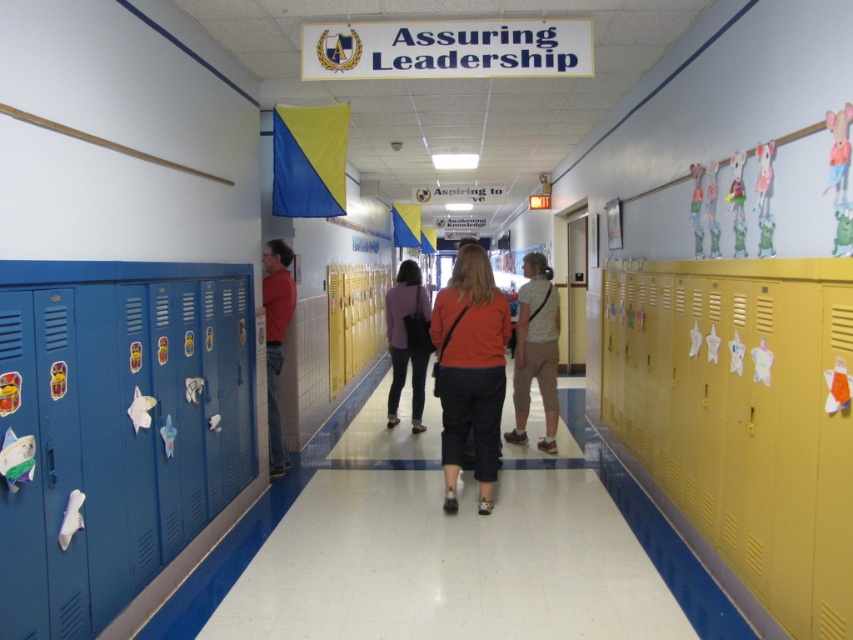
You are a student carrying a 3.5 feet wide poster. You need to walk through the hallway between the matte purple sweater at center and the matte red shirt at left. Will the poster fit through the space?

The distance between the matte purple sweater at center and the matte red shirt at left is 5.03 feet. Since the poster is 3.5 feet wide, it will fit through the space as there is enough room.